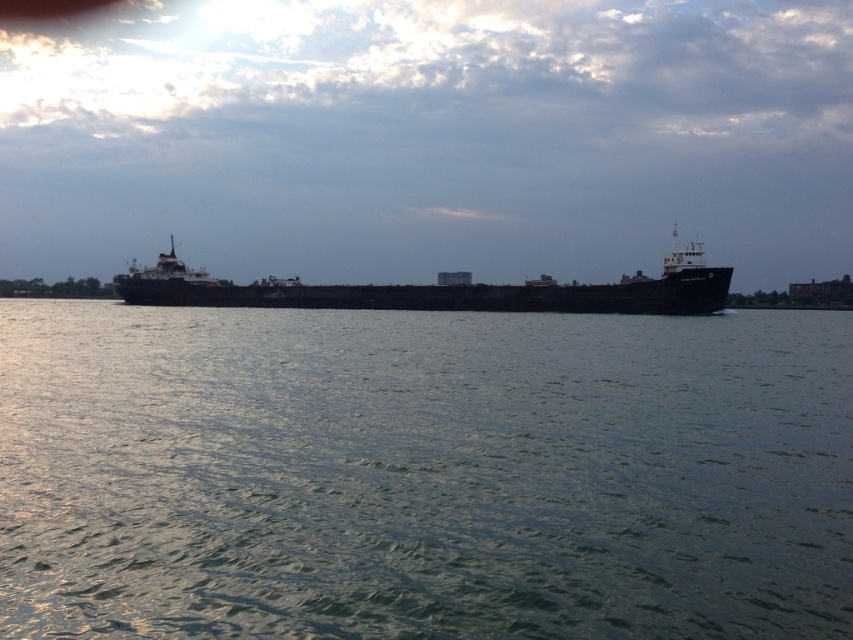
Can you confirm if green water at center is shorter than black matte ship at center?

Indeed, green water at center has a lesser height compared to black matte ship at center.

Between point (119, 381) and point (375, 300), which one is positioned behind?

Point (375, 300)

Is point (729, 400) farther from viewer compared to point (639, 284)?

That is False.

Identify the location of green water at center. The width and height of the screenshot is (853, 640). (422, 474).